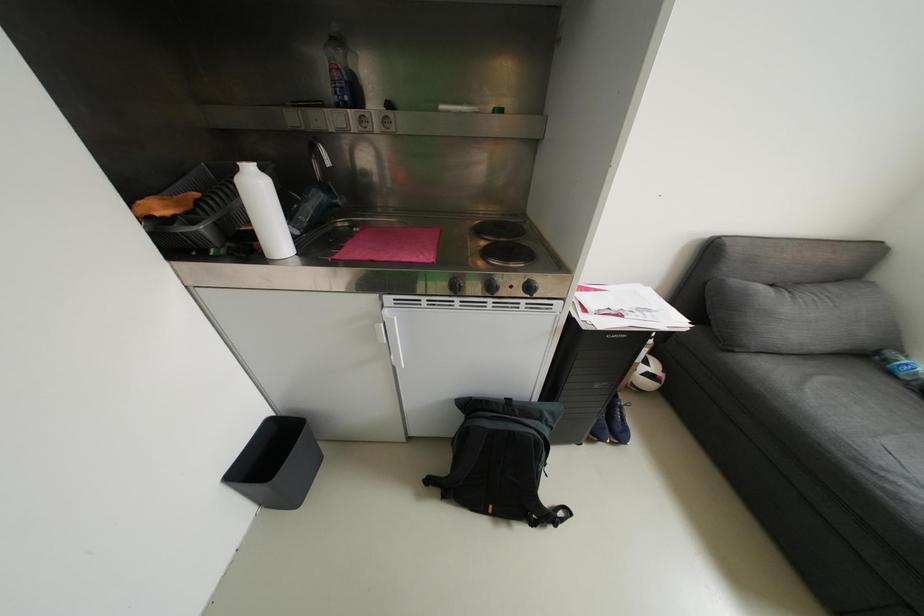
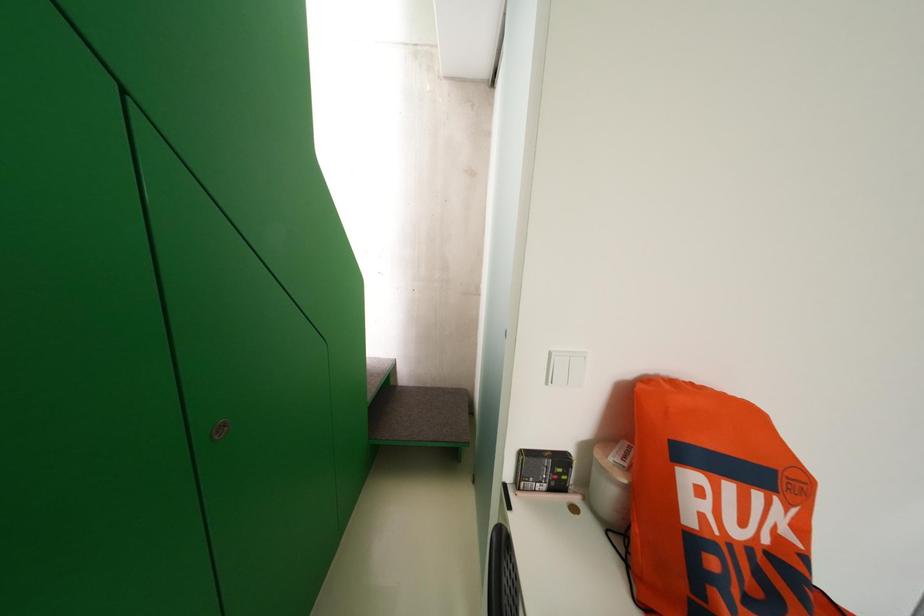
Question: The camera is either moving clockwise (left) or counter-clockwise (right) around the object. The first image is from the beginning of the video and the second image is from the end. Is the camera moving left or right when shooting the video?

Choices:
 (A) Left
 (B) Right

Answer: (B)